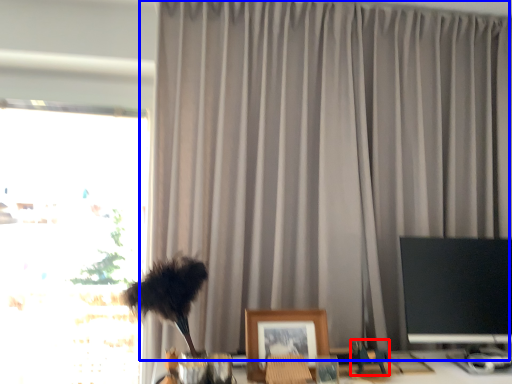
Question: Which object is further to the camera taking this photo, toy (highlighted by a red box) or curtain (highlighted by a blue box)?

Choices:
 (A) toy
 (B) curtain

Answer: (B)